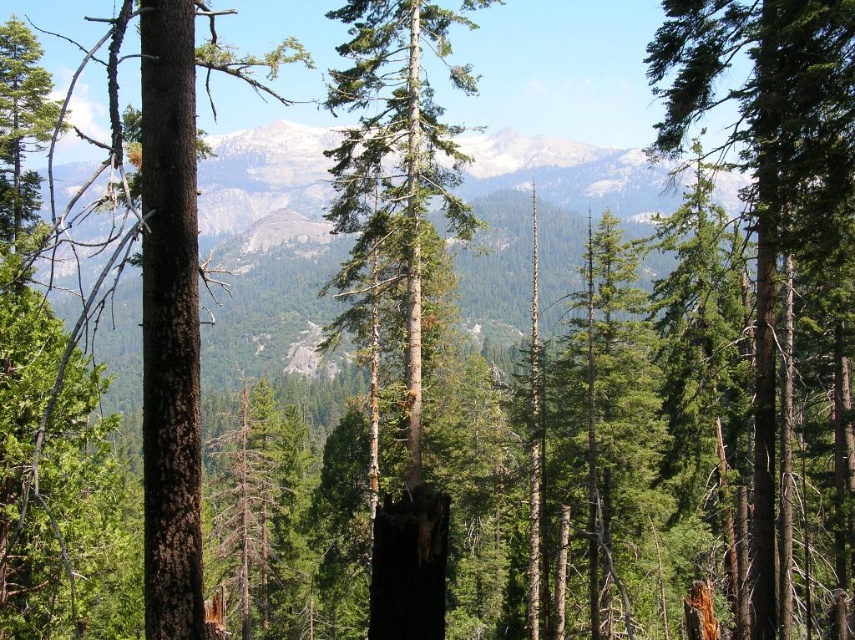
You are a hiker trying to navigate through the forest. You see a green rough bark tree at center and a green matte tree at right. Which tree should you walk towards if you want to head towards the right side of the forest?

You should walk towards the green matte tree at right because the green rough bark tree at center is to the left of it, meaning the green matte tree at right is positioned further to the right in the forest.

From the picture: You are a hiker in the forest trying to navigate between the green rough bark tree at center and the green matte tree at right. Which tree should you choose to pass through if you need to walk through the narrower space between them?

You should choose the green rough bark tree at center because it has a lesser width compared to the green matte tree at right, making the space between them narrower there.